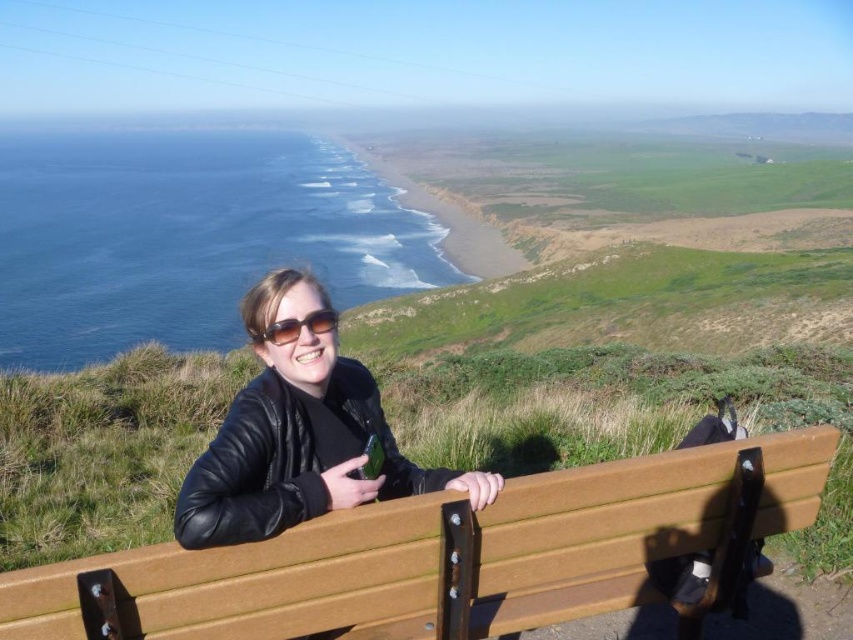
Is point (480, 241) positioned behind point (299, 321)?

Yes, it is behind point (299, 321).

Who is positioned more to the left, green grassy shoreline at center or black matte sunglasses at center?

Positioned to the left is green grassy shoreline at center.

Image resolution: width=853 pixels, height=640 pixels. I want to click on green grassy shoreline at center, so click(444, 216).

Can you confirm if wooden bench at center is bigger than green grassy shoreline at center?

No, wooden bench at center is not bigger than green grassy shoreline at center.

Does point (396, 573) come behind point (355, 138)?

No.

Measure the distance between point (457, 628) and camera.

Point (457, 628) and camera are 2.29 meters apart.

Find the location of `wooden bench at center`. wooden bench at center is located at coordinates 440,556.

Looking at this image, can you confirm if wooden bench at center is wider than black matte sunglasses at center?

Correct, the width of wooden bench at center exceeds that of black matte sunglasses at center.

Can you confirm if wooden bench at center is positioned above black matte sunglasses at center?

Actually, wooden bench at center is below black matte sunglasses at center.

Is point (252, 621) more distant than point (335, 320)?

No, it is in front of (335, 320).

Where is `wooden bench at center`? Image resolution: width=853 pixels, height=640 pixels. wooden bench at center is located at coordinates (440, 556).